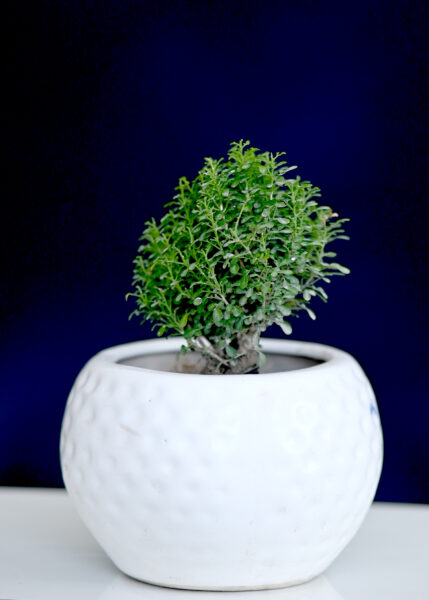
You are a GUI agent. You are given a task and a screenshot of the screen. Output one action in this format:
    pyautogui.click(x=<x>, y=<y>)
    Task: Click on the glass
    The width and height of the screenshot is (429, 600).
    Given the screenshot: What is the action you would take?
    pyautogui.click(x=180, y=474)